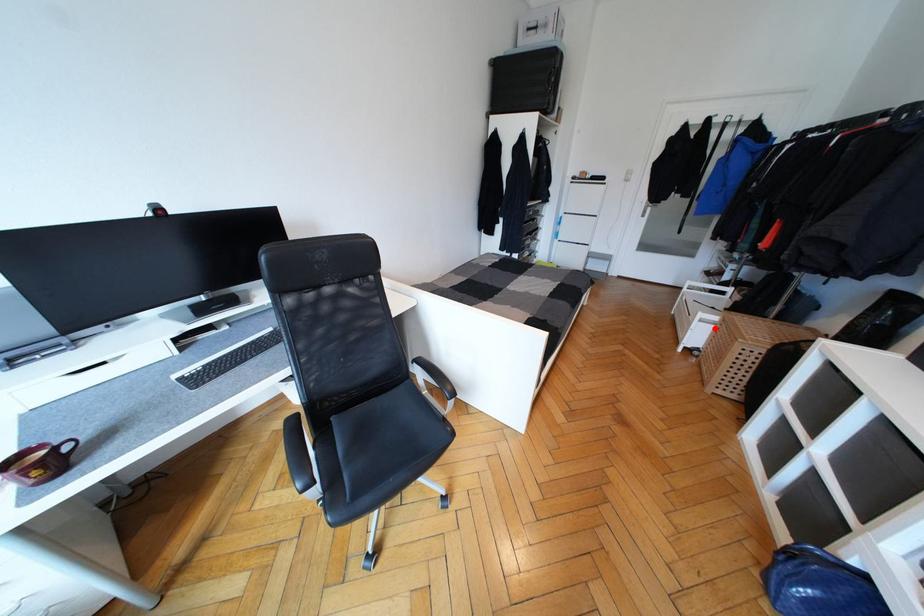
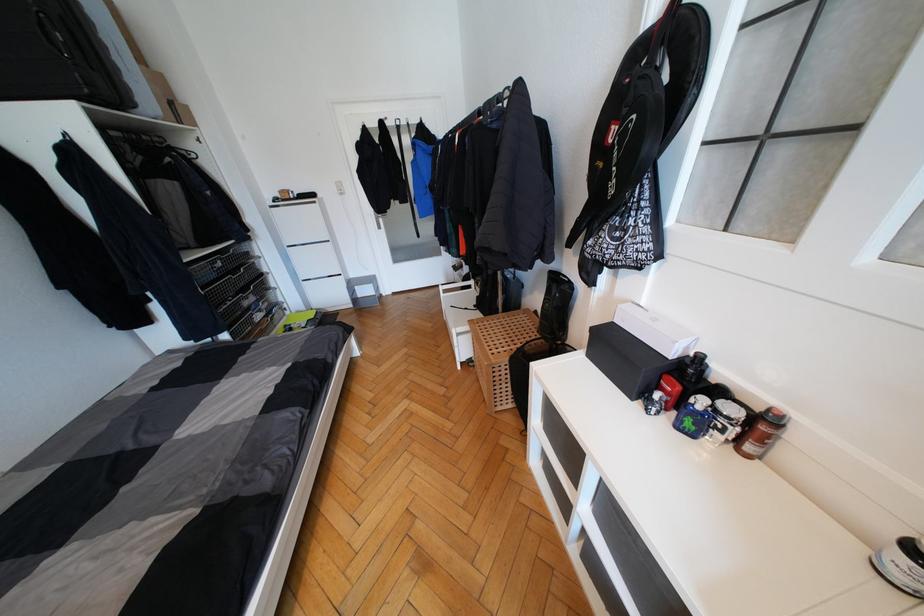
Question: I am providing you with two images of the same scene from different viewpoints. Image1 has a red point marked. In image2, the corresponding 3D location appears at what relative position? Reply with the corresponding letter.

Choices:
 (A) Closer
 (B) Farther

Answer: (B)